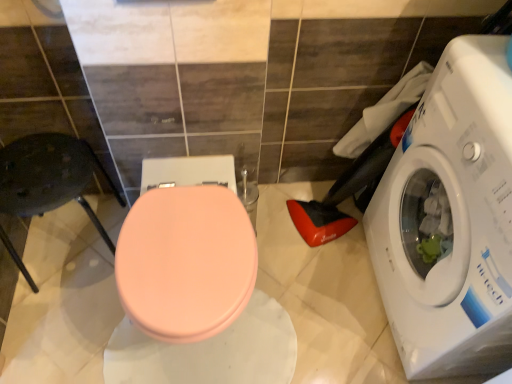
Identify the location of spots to the right of matte pink lid at center. (317, 298).